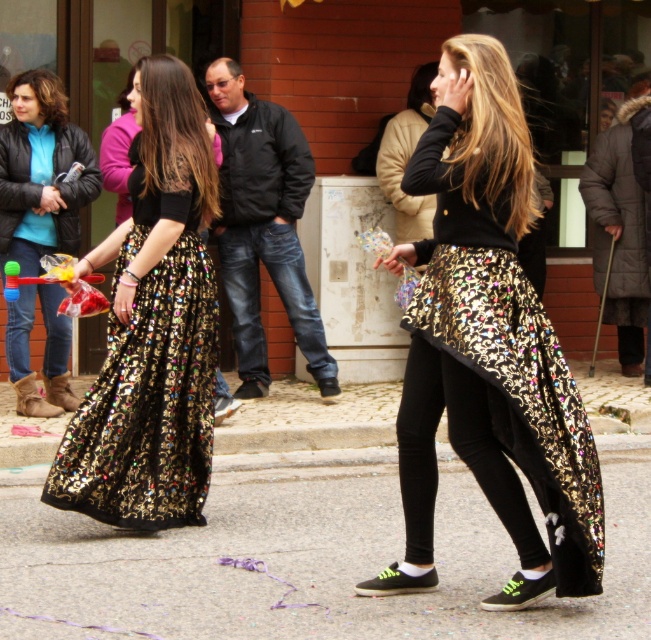
Between shiny asphalt pavement at center and shiny metallic skirt at left, which one is positioned lower?

shiny asphalt pavement at center

Based on the photo, does shiny asphalt pavement at center have a greater width compared to shiny metallic skirt at left?

Indeed, shiny asphalt pavement at center has a greater width compared to shiny metallic skirt at left.

Does point (411, 609) come closer to viewer compared to point (174, 337)?

Yes, point (411, 609) is in front of point (174, 337).

This screenshot has height=640, width=651. I want to click on shiny asphalt pavement at center, so click(x=309, y=557).

Does shiny sequined skirt at center appear over shiny metallic skirt at left?

Yes, shiny sequined skirt at center is above shiny metallic skirt at left.

Is shiny sequined skirt at center closer to camera compared to shiny metallic skirt at left?

Yes.

Who is more forward, (505,257) or (152,330)?

Positioned in front is point (505,257).

The image size is (651, 640). In order to click on shiny sequined skirt at center in this screenshot , I will do `click(490, 344)`.

Which is more to the right, shiny asphalt pavement at center or shiny sequined skirt at center?

From the viewer's perspective, shiny sequined skirt at center appears more on the right side.

Between point (646, 586) and point (450, 355), which one is positioned in front?

Point (450, 355) is in front.

Locate an element on the screen. Image resolution: width=651 pixels, height=640 pixels. shiny asphalt pavement at center is located at coordinates tap(309, 557).